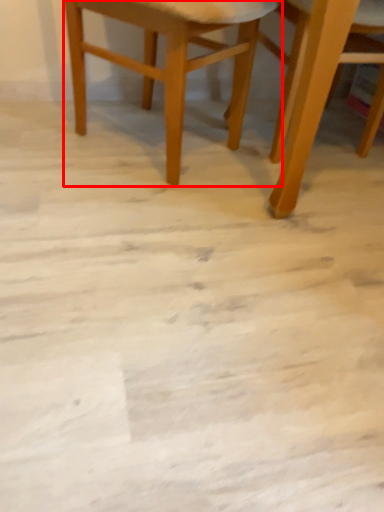
Question: From the image's perspective, considering the relative positions of chair (annotated by the red box) and chair in the image provided, where is chair (annotated by the red box) located with respect to the staircase?

Choices:
 (A) above
 (B) below

Answer: (A)